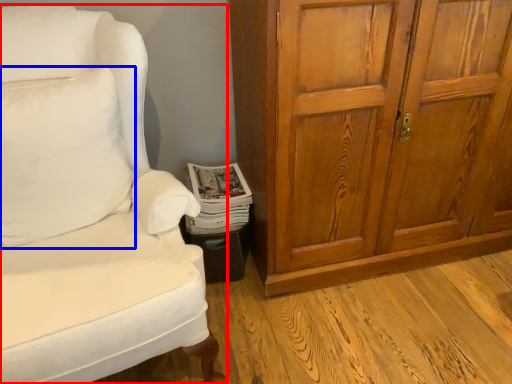
Question: Which of the following is the farthest to the observer, chair (highlighted by a red box) or pillow (highlighted by a blue box)?

Choices:
 (A) chair
 (B) pillow

Answer: (B)